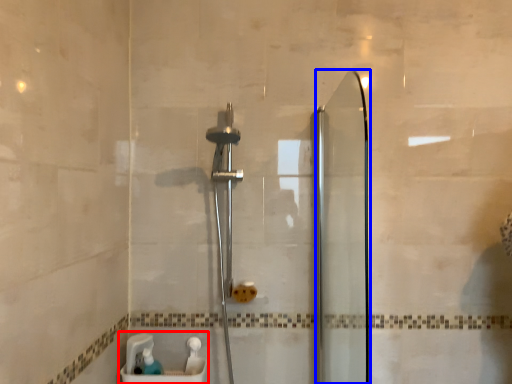
Question: Which object appears farthest to the camera in this image, sink (highlighted by a red box) or screen door (highlighted by a blue box)?

Choices:
 (A) sink
 (B) screen door

Answer: (A)